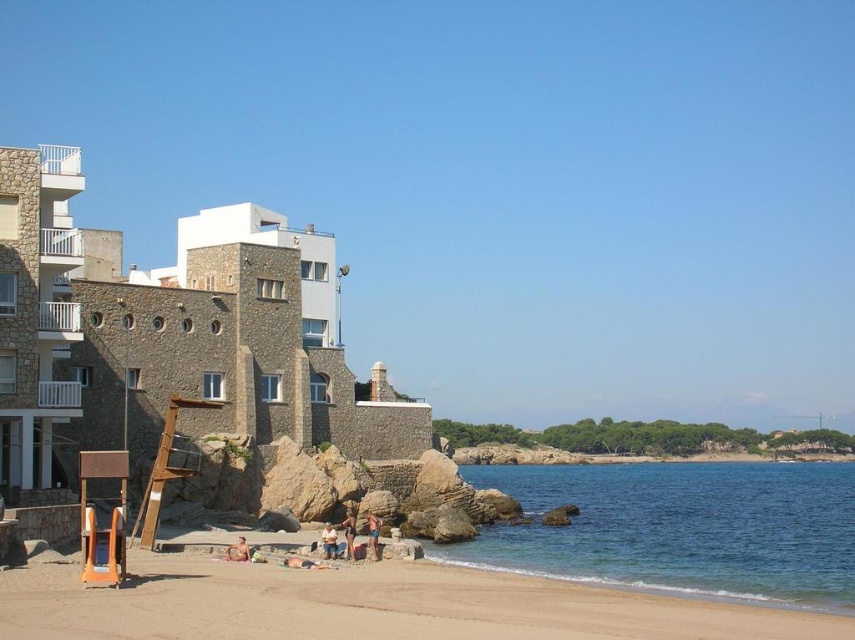
You are a photographer trying to capture a photo of the blue denim shorts at lower center and the matte skin person at center. Since you want both subjects to appear equally prominent in the photo, which one should you zoom in on more?

The blue denim shorts at lower center is larger in size than the matte skin person at center, so you should zoom in more on the matte skin person at center to make them appear the same size in the photo.

You are standing on the beach and want to take a photo of the stone textured building at left without any people in the frame. Is the tan skin person at lower center currently blocking your view of the building?

The tan skin person at lower center is behind the stone textured building at left, so they are not blocking the view. You can take the photo without any obstruction.

You are standing on the sandy beach at lower center and want to see the matte skin person at center. Can you see them clearly from your position?

The sandy beach at lower center is above the matte skin person at center, so yes, you can see them clearly from your position.